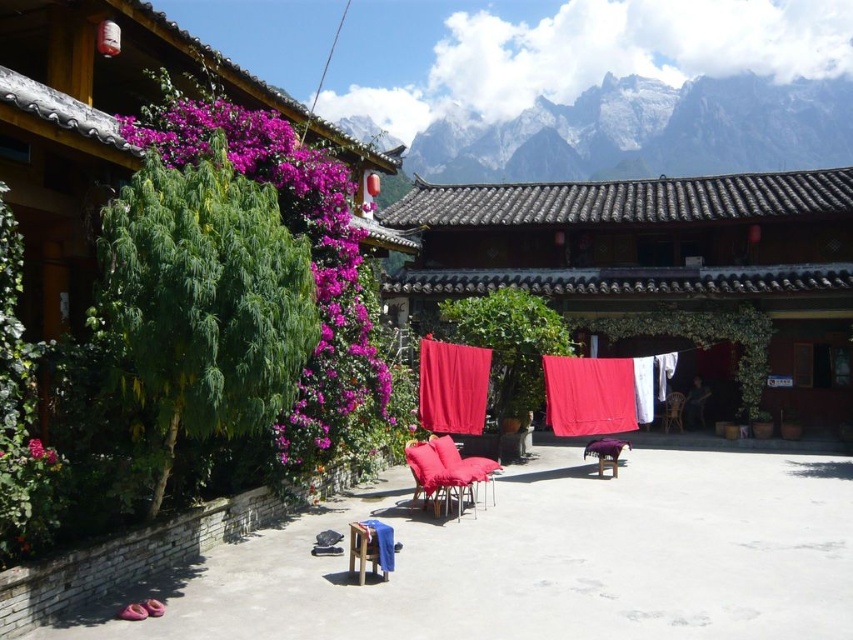
Question: Which point is closer to the camera?

Choices:
 (A) (640, 592)
 (B) (488, 477)
 (C) (619, 403)
 (D) (671, 419)

Answer: (A)

Question: Among these objects, which one is farthest from the camera?

Choices:
 (A) matte red armchair at center
 (B) white rocky mountain at upper center
 (C) matte red curtain at center

Answer: (B)

Question: Is white rocky mountain at upper center bigger than wooden armchair at center?

Choices:
 (A) yes
 (B) no

Answer: (A)

Question: Estimate the real-world distances between objects in this image. Which object is closer to the blue cotton blanket at lower center?

Choices:
 (A) smooth concrete floor at center
 (B) red matte curtain at center

Answer: (A)

Question: From the image, what is the correct spatial relationship of smooth concrete floor at center in relation to purple leafy plant at left?

Choices:
 (A) left
 (B) right

Answer: (B)

Question: Where is blue cotton blanket at lower center located in relation to purple matte flower at upper left in the image?

Choices:
 (A) left
 (B) right

Answer: (B)